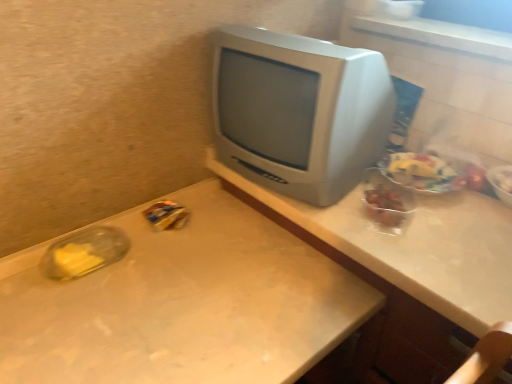
You are a GUI agent. You are given a task and a screenshot of the screen. Output one action in this format:
    pyautogui.click(x=<x>, y=<y>)
    Task: Click on the free space between translucent plastic bowl at upper right, the fourth food in the left-to-right sequence, and translucent plastic container at right, which is counted as the third food, starting from the right
    
    Given the screenshot: What is the action you would take?
    pyautogui.click(x=451, y=208)